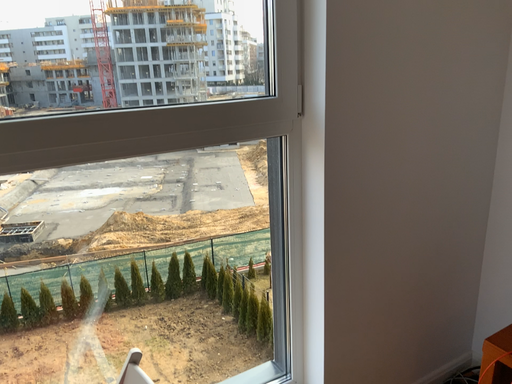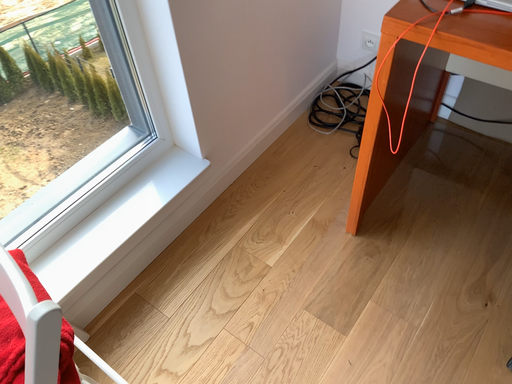
Question: How did the camera likely rotate when shooting the video?

Choices:
 (A) rotated upward
 (B) rotated downward

Answer: (B)